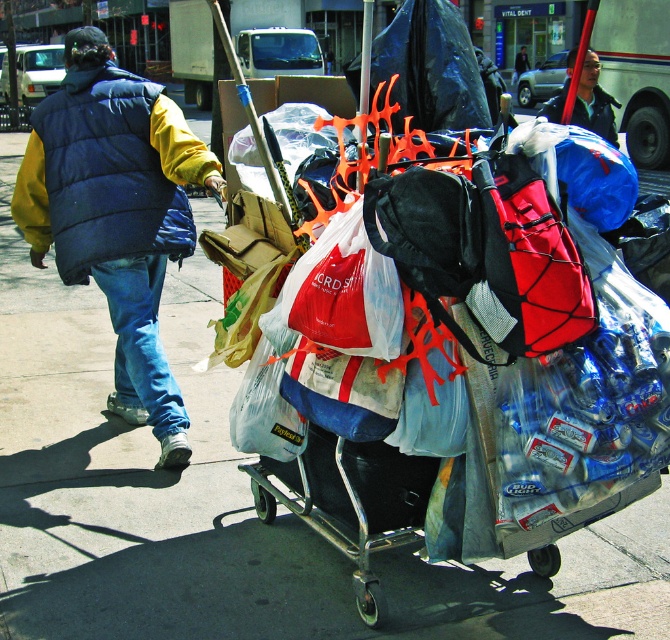
You are a pedestrian observing the person in the scene. Which clothing item is positioned lower on the person, the blue puffy vest at upper left or the dark blue jacket at center?

The blue puffy vest at upper left is located below the dark blue jacket at center, so the blue puffy vest at upper left is positioned lower on the person.

What is the 2D coordinate of the blue puffy vest at upper left in the image?

The blue puffy vest at upper left is located at the 2D coordinate point of [107,172].